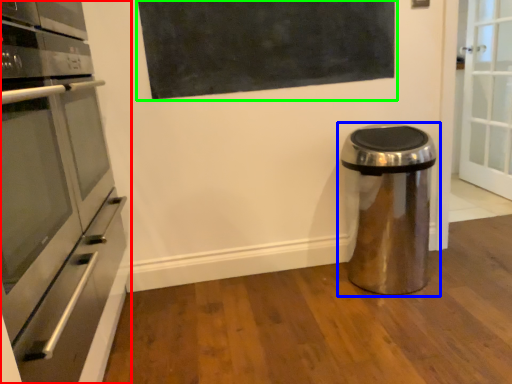
Question: Considering the real-world distances, which object is farthest from home appliance (highlighted by a red box)? waste container (highlighted by a blue box) or bulletin board (highlighted by a green box)?

Choices:
 (A) waste container
 (B) bulletin board

Answer: (A)